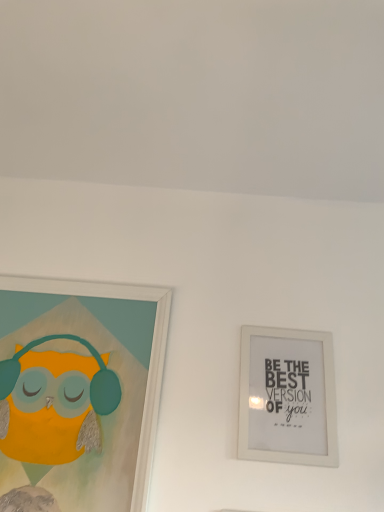
Question: Is matte white picture frame at left, marked as the second picture frame in a right-to-left arrangement, wider or thinner than white matte picture frame at upper right, which is counted as the first picture frame, starting from the right?

Choices:
 (A) wide
 (B) thin

Answer: (A)

Question: Looking at the image, does matte white picture frame at left, marked as the second picture frame in a right-to-left arrangement, seem bigger or smaller compared to white matte picture frame at upper right, which is counted as the first picture frame, starting from the right?

Choices:
 (A) big
 (B) small

Answer: (A)

Question: Considering the relative positions of matte white picture frame at left, marked as the second picture frame in a right-to-left arrangement, and white matte picture frame at upper right, which is counted as the first picture frame, starting from the right, in the image provided, is matte white picture frame at left, marked as the second picture frame in a right-to-left arrangement, to the left or to the right of white matte picture frame at upper right, which is counted as the first picture frame, starting from the right,?

Choices:
 (A) left
 (B) right

Answer: (A)

Question: From the image's perspective, is white matte picture frame at upper right, positioned as the 2th picture frame in left-to-right order, located above or below matte white picture frame at left, marked as the 1th picture frame in a left-to-right arrangement?

Choices:
 (A) below
 (B) above

Answer: (A)

Question: Considering the positions of white matte picture frame at upper right, positioned as the 2th picture frame in left-to-right order, and matte white picture frame at left, marked as the 1th picture frame in a left-to-right arrangement, in the image, is white matte picture frame at upper right, positioned as the 2th picture frame in left-to-right order, bigger or smaller than matte white picture frame at left, marked as the 1th picture frame in a left-to-right arrangement,?

Choices:
 (A) big
 (B) small

Answer: (B)

Question: Is white matte picture frame at upper right, positioned as the 2th picture frame in left-to-right order, spatially inside matte white picture frame at left, marked as the 1th picture frame in a left-to-right arrangement, or outside of it?

Choices:
 (A) outside
 (B) inside

Answer: (A)

Question: Is white matte picture frame at upper right, which is counted as the first picture frame, starting from the right, in front of or behind matte white picture frame at left, marked as the second picture frame in a right-to-left arrangement, in the image?

Choices:
 (A) front
 (B) behind

Answer: (B)